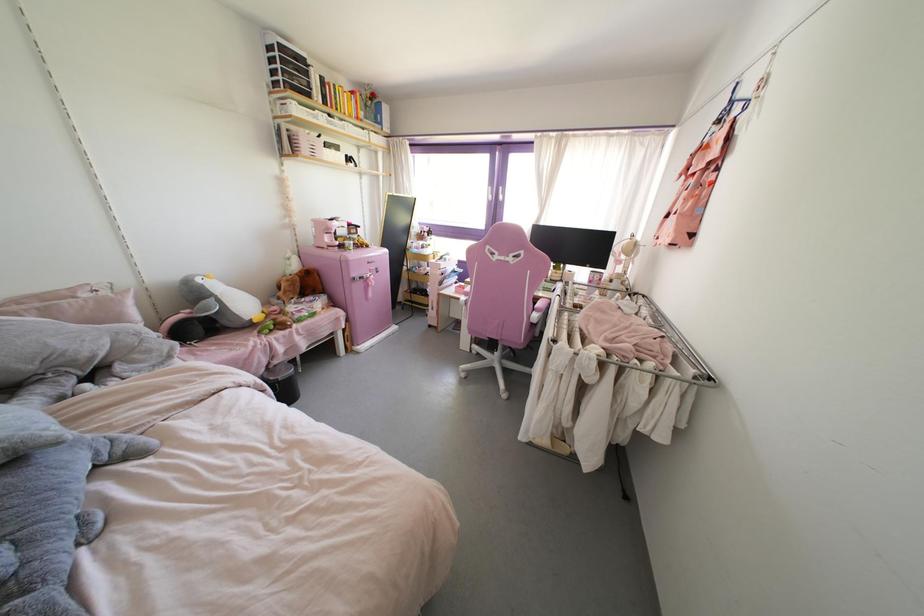
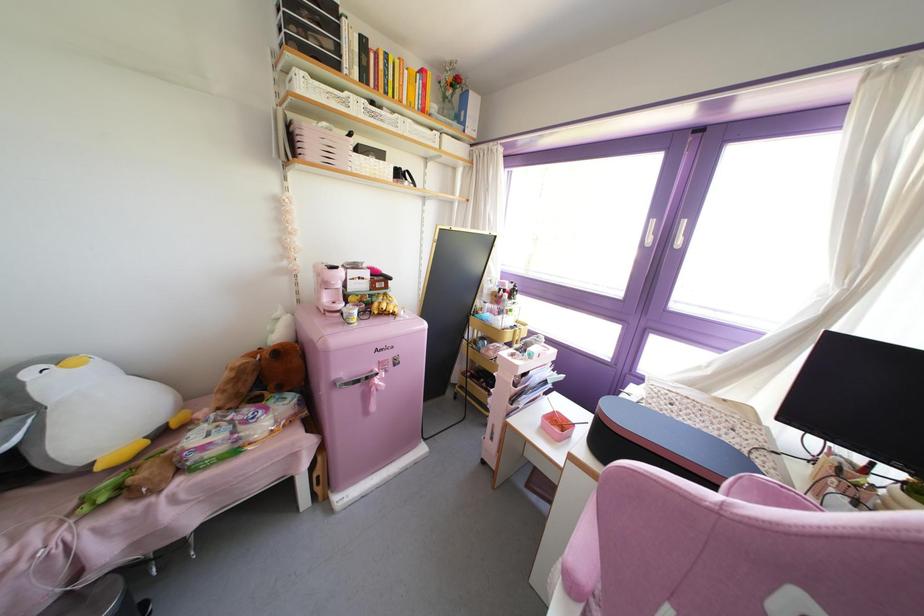
The point at (304,148) is marked in the first image. Where is the corresponding point in the second image?

(310, 148)